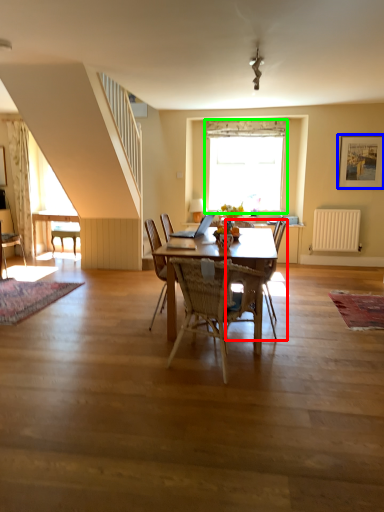
Question: Estimate the real-world distances between objects in this image. Which object is closer to armchair (highlighted by a red box), picture frame (highlighted by a blue box) or window (highlighted by a green box)?

Choices:
 (A) picture frame
 (B) window

Answer: (B)